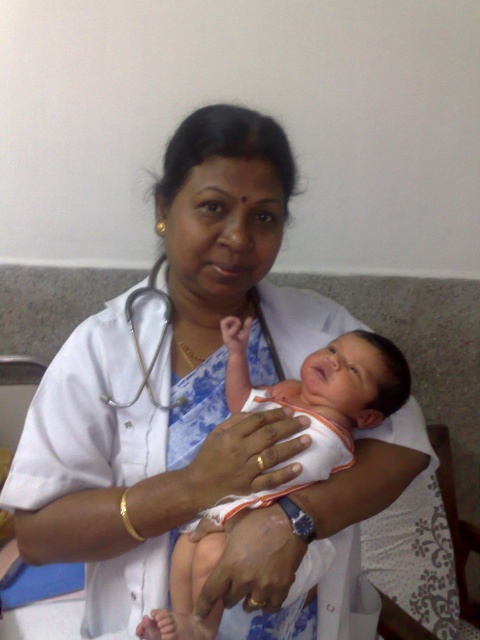
What is located at the coordinates point (290, 458) in the image?

The point (290, 458) is where the white cotton newborn at center is located.

Based on the scene description, where is the white cotton newborn at center located in terms of coordinates?

The white cotton newborn at center is located at coordinates point (290, 458).